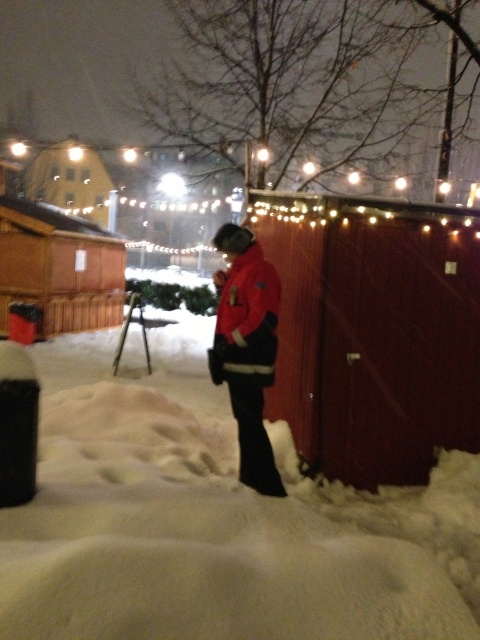
Question: Does white fluffy snow at lower center have a greater width compared to metallic tripod at center?

Choices:
 (A) no
 (B) yes

Answer: (B)

Question: Among these objects, which one is nearest to the camera?

Choices:
 (A) wooden hut at upper center
 (B) metallic tripod at center

Answer: (B)

Question: Is white fluffy snow at lower center closer to camera compared to wooden hut at upper left?

Choices:
 (A) no
 (B) yes

Answer: (B)

Question: Does wooden hut at upper left come in front of red matte jacket at center?

Choices:
 (A) no
 (B) yes

Answer: (A)

Question: Which object is positioned farthest from the wooden hut at upper left?

Choices:
 (A) wooden hut at upper center
 (B) metallic tripod at center

Answer: (A)

Question: Which point is farther to the camera?

Choices:
 (A) wooden hut at upper left
 (B) red matte jacket at center
 (C) wooden cabin at center
 (D) wooden hut at upper center

Answer: (D)